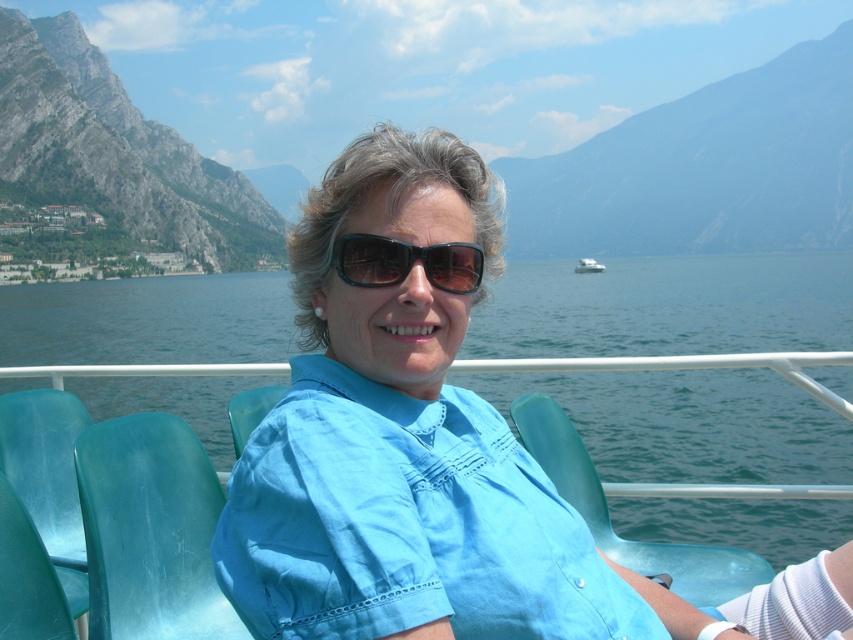
Question: Which object appears farthest from the camera in this image?

Choices:
 (A) matte gray rock at upper center
 (B) rugged stone mountain at left
 (C) rocky cliff at upper left
 (D) green plastic chair at center

Answer: (A)

Question: Observing the image, what is the correct spatial positioning of rocky cliff at upper left in reference to translucent teal chair at center?

Choices:
 (A) right
 (B) left

Answer: (A)

Question: Can you confirm if matte gray rock at upper center is positioned to the left of teal plastic chair at lower left?

Choices:
 (A) no
 (B) yes

Answer: (A)

Question: Estimate the real-world distances between objects in this image. Which object is farther from the blue cotton shirt at center?

Choices:
 (A) rugged stone mountain at left
 (B) black plastic sunglasses at center

Answer: (A)

Question: Which of the following is the closest to the observer?

Choices:
 (A) (242, 420)
 (B) (582, 264)
 (C) (743, 236)

Answer: (A)

Question: Does matte gray rock at upper center come in front of green plastic chair at center?

Choices:
 (A) no
 (B) yes

Answer: (A)